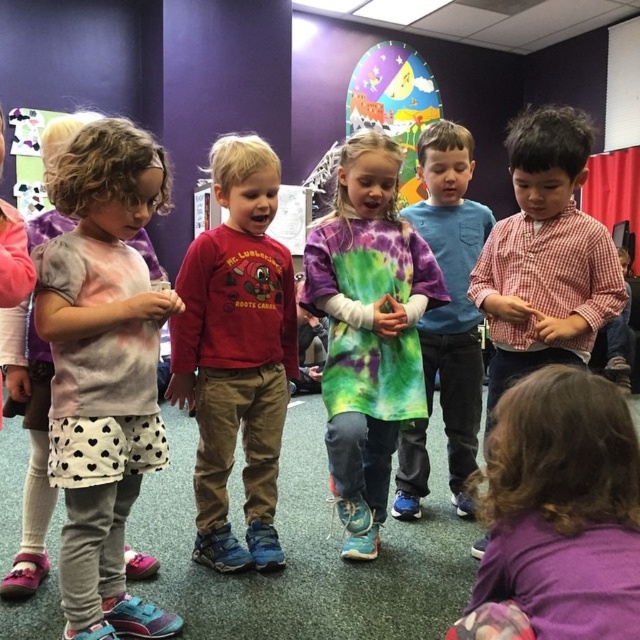
Based on the photo, you are a photographer positioned at the center of the room. You want to capture a photo that includes the purple fabric shirt at lower right. Based on the coordinates provided, where should you aim your camera to ensure the shirt is centered in the frame?

To center the purple fabric shirt at lower right in the frame, aim your camera at the coordinates point (557,515) provided in the description.